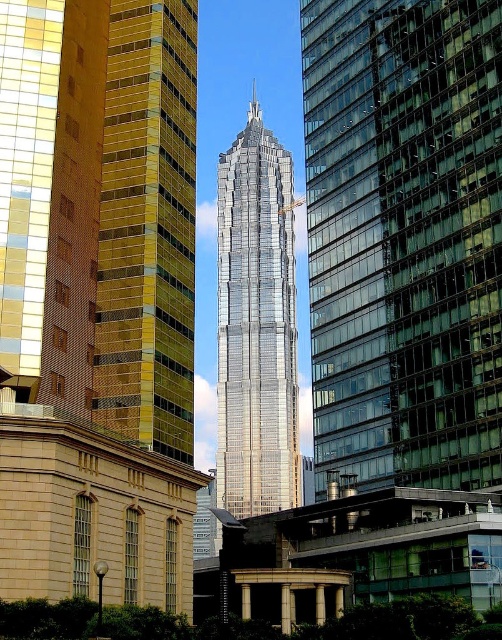
Does point (393, 467) come behind point (111, 93)?

Yes, it is.

Can you confirm if shiny glass skyscraper at center is thinner than gold reflective glass tower at left?

No, shiny glass skyscraper at center is not thinner than gold reflective glass tower at left.

Between point (425, 109) and point (99, 340), which one is positioned in front?

Point (99, 340) is in front.

I want to click on shiny glass skyscraper at center, so click(x=405, y=237).

Does shiny glass skyscraper at center come behind shiny silver skyscraper at center?

That is False.

Is shiny glass skyscraper at center thinner than shiny silver skyscraper at center?

Yes.

This screenshot has height=640, width=502. I want to click on shiny glass skyscraper at center, so click(x=405, y=237).

Looking at this image, who is positioned more to the right, gold reflective glass tower at left or shiny silver skyscraper at center?

gold reflective glass tower at left

Which is in front, point (143, 140) or point (245, 452)?

Point (143, 140) is in front.

Is point (120, 188) positioned behind point (258, 388)?

No, (120, 188) is closer to viewer.

In order to click on gold reflective glass tower at left in this screenshot , I will do `click(148, 227)`.